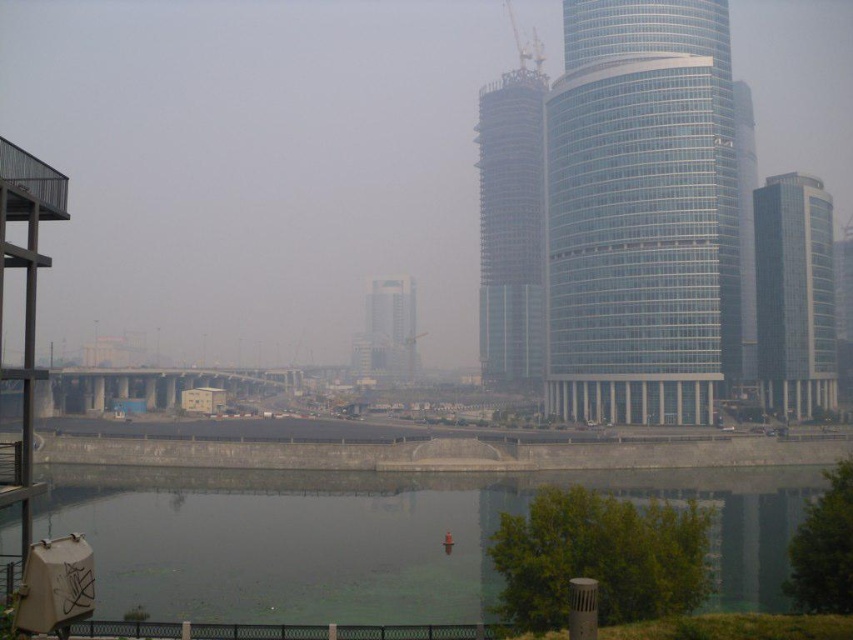
Is transparent glass tower at center smaller than clear glass skyscraper at center?

Yes.

Describe the element at coordinates (641, 211) in the screenshot. I see `transparent glass tower at center` at that location.

I want to click on transparent glass tower at center, so click(x=641, y=211).

Where is `transparent glass tower at center`? transparent glass tower at center is located at coordinates (641, 211).

Which is more to the right, transparent glass tower at center or dark green water at lower center?

From the viewer's perspective, transparent glass tower at center appears more on the right side.

Does transparent glass tower at center have a lesser width compared to dark green water at lower center?

Correct, transparent glass tower at center's width is less than dark green water at lower center's.

Locate an element on the screen. The width and height of the screenshot is (853, 640). transparent glass tower at center is located at coordinates (641, 211).

Is clear glass skyscraper at center below white glass building at center?

No, clear glass skyscraper at center is not below white glass building at center.

The height and width of the screenshot is (640, 853). What do you see at coordinates (511, 228) in the screenshot?
I see `clear glass skyscraper at center` at bounding box center [511, 228].

Is point (492, 104) positioned after point (402, 336)?

That is False.

Locate an element on the screen. Image resolution: width=853 pixels, height=640 pixels. clear glass skyscraper at center is located at coordinates (511, 228).